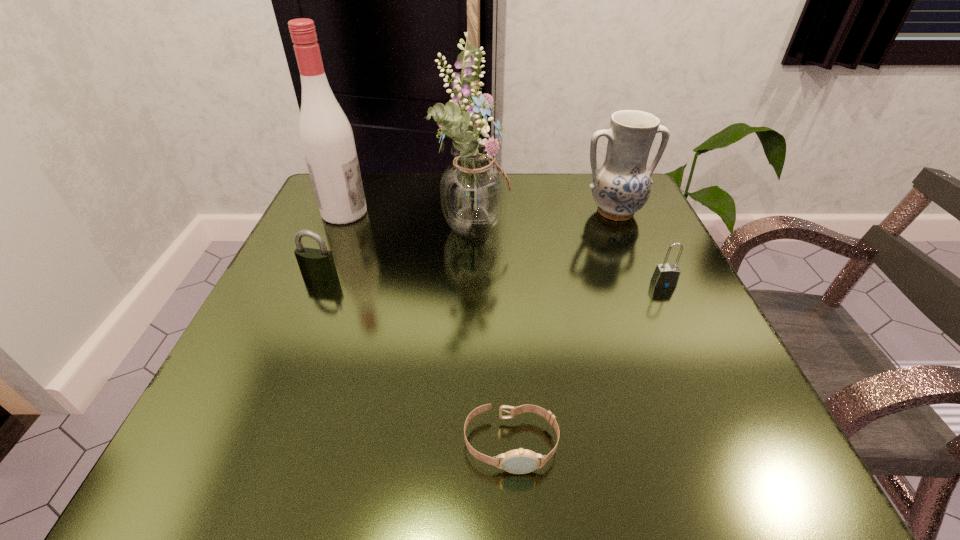
The height and width of the screenshot is (540, 960). I want to click on object situated at the far left corner, so tap(326, 136).

What are the coordinates of `object that is at the far right corner` in the screenshot? It's located at point(621,186).

Where is `vacant area at the far edge`? Image resolution: width=960 pixels, height=540 pixels. vacant area at the far edge is located at coordinates (432, 226).

This screenshot has width=960, height=540. What are the coordinates of `vacant area at the left edge of the desktop` in the screenshot? It's located at (337, 231).

In the image, there is a desktop. In order to click on vacant space at the right edge in this screenshot , I will do `click(679, 398)`.

Image resolution: width=960 pixels, height=540 pixels. In order to click on free space at the far left corner in this screenshot , I will do `click(316, 205)`.

Identify the location of vacant space at the far right corner of the desktop. The image size is (960, 540). (593, 207).

Identify the location of free region at the near right corner. This screenshot has width=960, height=540. (722, 448).

The width and height of the screenshot is (960, 540). I want to click on vacant point located between the watch and the left padlock, so click(x=416, y=360).

Identify the location of unoccupied area between the right padlock and the bouquet. Image resolution: width=960 pixels, height=540 pixels. (569, 253).